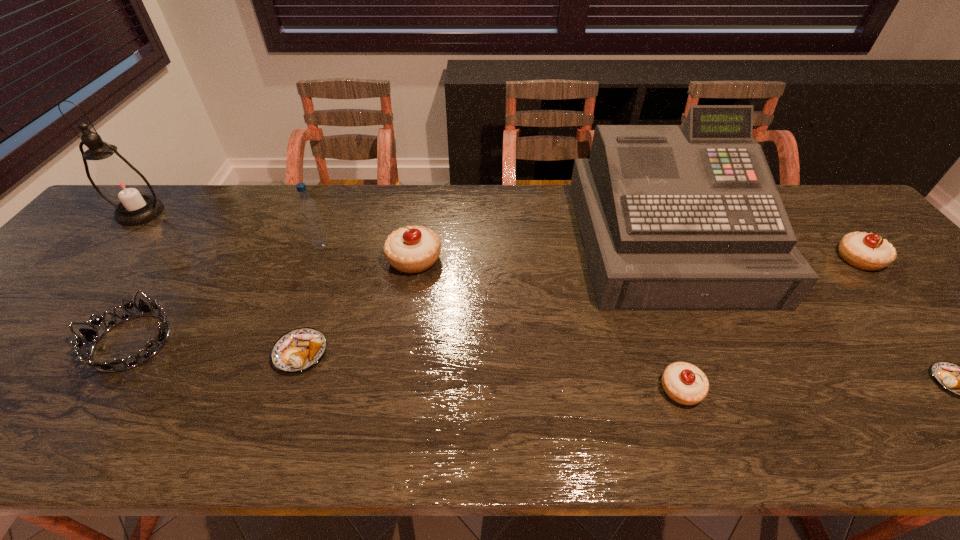
Image resolution: width=960 pixels, height=540 pixels. Find the location of `vacant space situated on the left of the leftmost pastry`. vacant space situated on the left of the leftmost pastry is located at coordinates (242, 353).

Locate an element on the screen. oil lamp located at the far edge is located at coordinates (123, 186).

Locate an element on the screen. cash register that is at the far edge is located at coordinates (688, 217).

I want to click on object situated at the near edge, so click(684, 383).

Image resolution: width=960 pixels, height=540 pixels. In order to click on object that is at the left edge in this screenshot , I will do `click(123, 186)`.

The height and width of the screenshot is (540, 960). I want to click on object at the right edge, so click(x=867, y=251).

I want to click on object present at the far left corner, so click(123, 186).

Where is `vacant space at the far edge`? The width and height of the screenshot is (960, 540). vacant space at the far edge is located at coordinates (382, 195).

Identify the location of vacant space at the near edge. (14, 442).

Find the location of `vacant space at the left edge of the desktop`. vacant space at the left edge of the desktop is located at coordinates (121, 247).